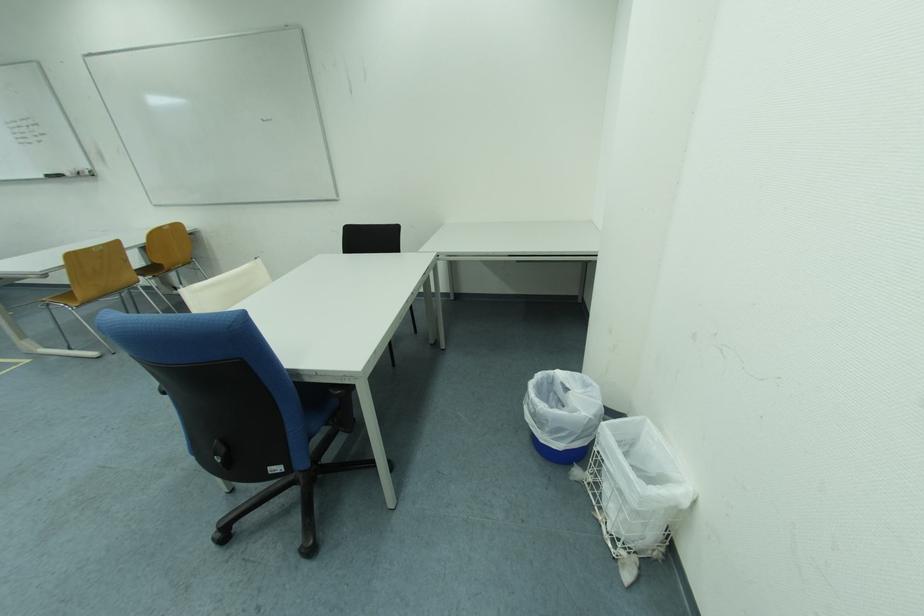
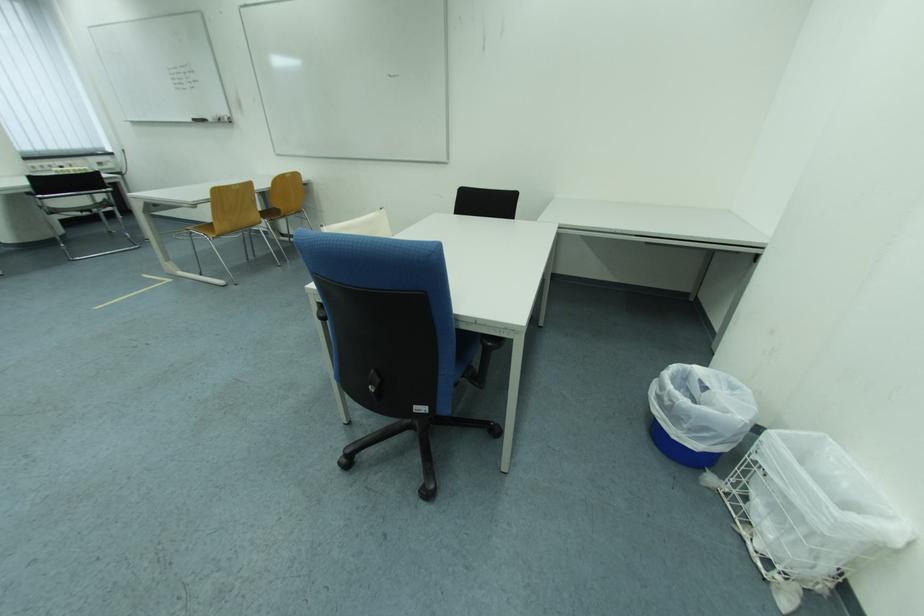
Locate, in the second image, the point that corresponds to pixel 594 387 in the first image.

(742, 390)